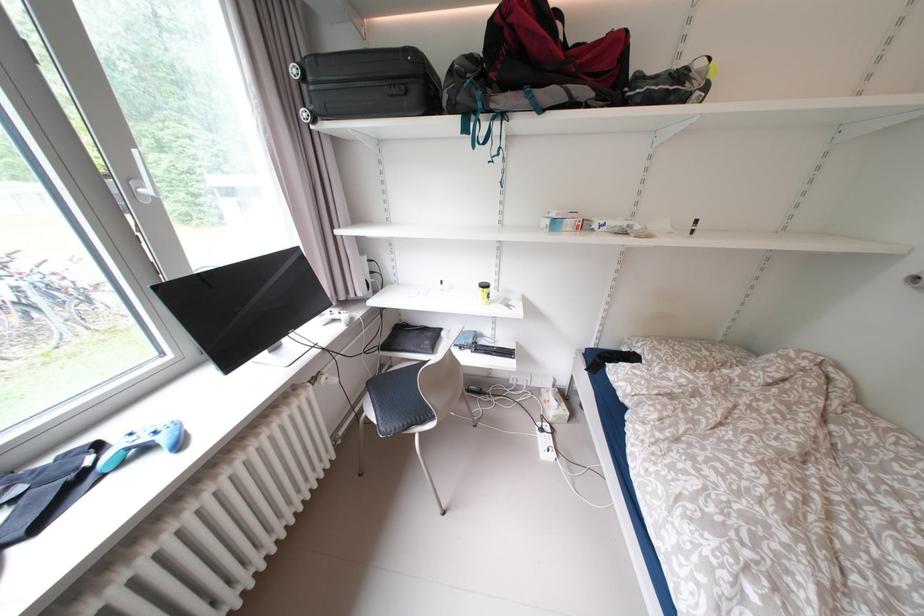
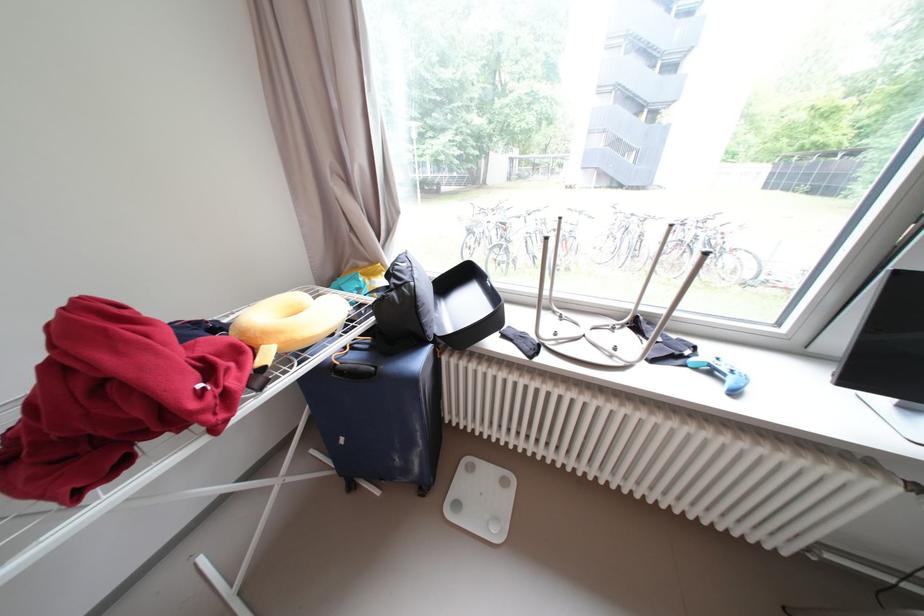
Locate, in the second image, the point that corresponds to point 99,482 in the first image.

(688, 363)